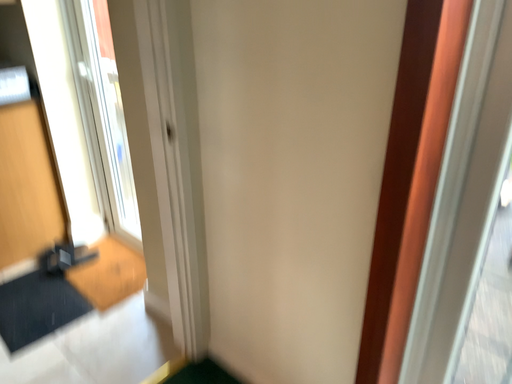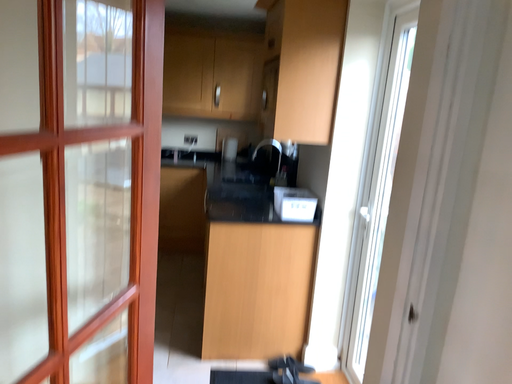
Question: Which way did the camera rotate in the video?

Choices:
 (A) rotated right
 (B) rotated left

Answer: (B)